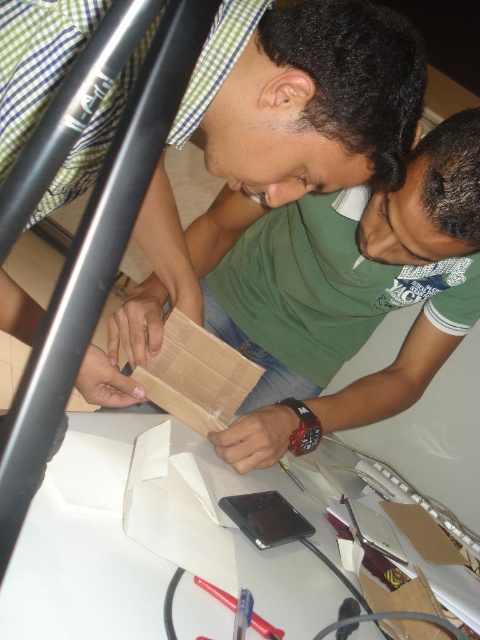
Identify the location of brown cardboard at center. (342, 292).

Is brown cardboard at center taller than metallic silver pen at lower center?

Correct, brown cardboard at center is much taller as metallic silver pen at lower center.

I want to click on brown cardboard at center, so click(342, 292).

Where is `brown cardboard at center`? This screenshot has width=480, height=640. brown cardboard at center is located at coordinates (342, 292).

Does brown cardboard at center appear on the left side of green matte shirt at center?

Incorrect, brown cardboard at center is not on the left side of green matte shirt at center.

Is brown cardboard at center bigger than green matte shirt at center?

Correct, brown cardboard at center is larger in size than green matte shirt at center.

Who is more distant from viewer, (316,358) or (392,156)?

The point (316,358) is behind.

This screenshot has width=480, height=640. In order to click on brown cardboard at center in this screenshot , I will do `click(342, 292)`.

Does green matte shirt at center have a greater height compared to metallic silver pen at lower center?

Yes, green matte shirt at center is taller than metallic silver pen at lower center.

Measure the distance from green matte shirt at center to metallic silver pen at lower center.

green matte shirt at center and metallic silver pen at lower center are 18.96 inches apart.

Is point (369, 164) positioned behind point (216, 588)?

Yes.

The width and height of the screenshot is (480, 640). I want to click on green matte shirt at center, so click(304, 97).